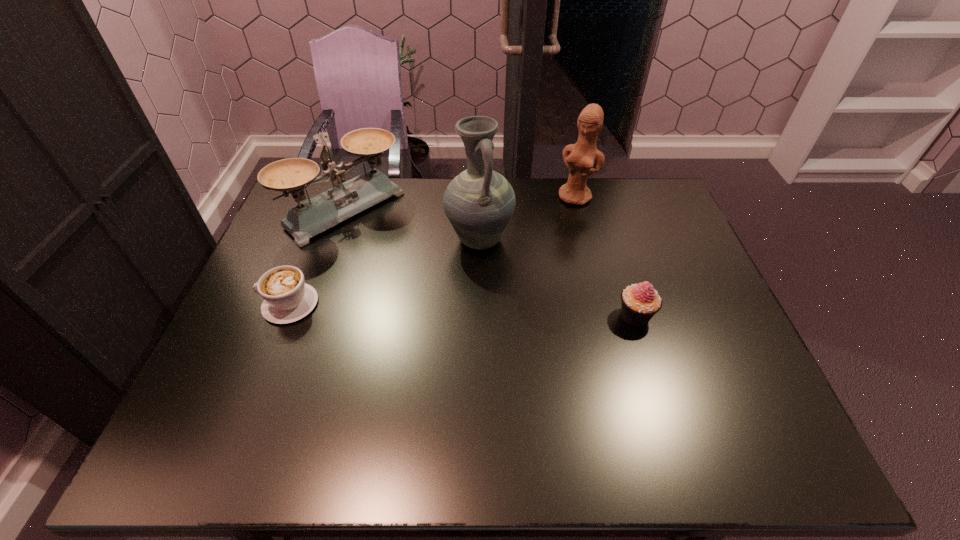
The height and width of the screenshot is (540, 960). Identify the location of free space that satisfies the following two spatial constraints: 1. on the front side of the cupcake; 2. on the left side of the pitcher. (479, 316).